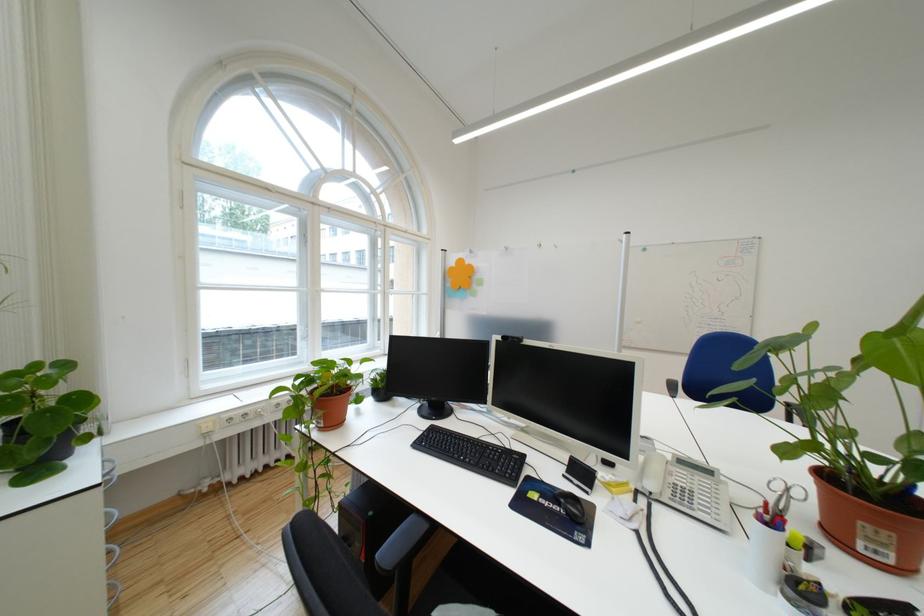
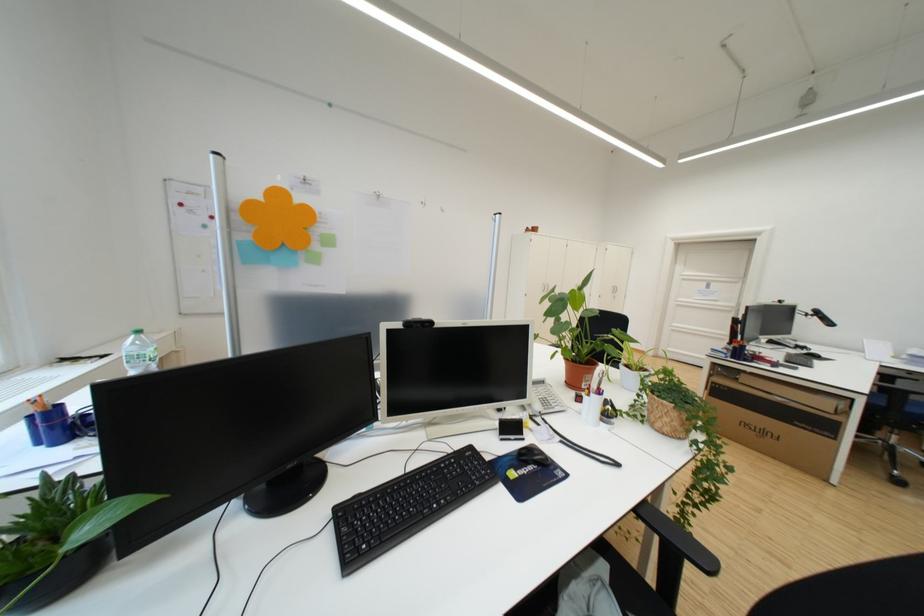
Question: The camera is either moving clockwise (left) or counter-clockwise (right) around the object. The first image is from the beginning of the video and the second image is from the end. Is the camera moving left or right when shooting the video?

Choices:
 (A) Left
 (B) Right

Answer: (A)